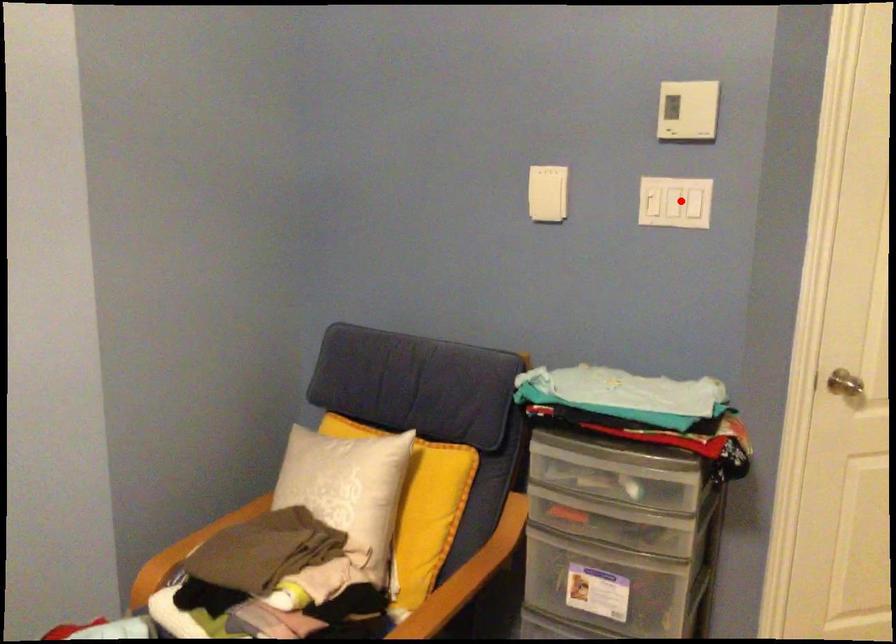
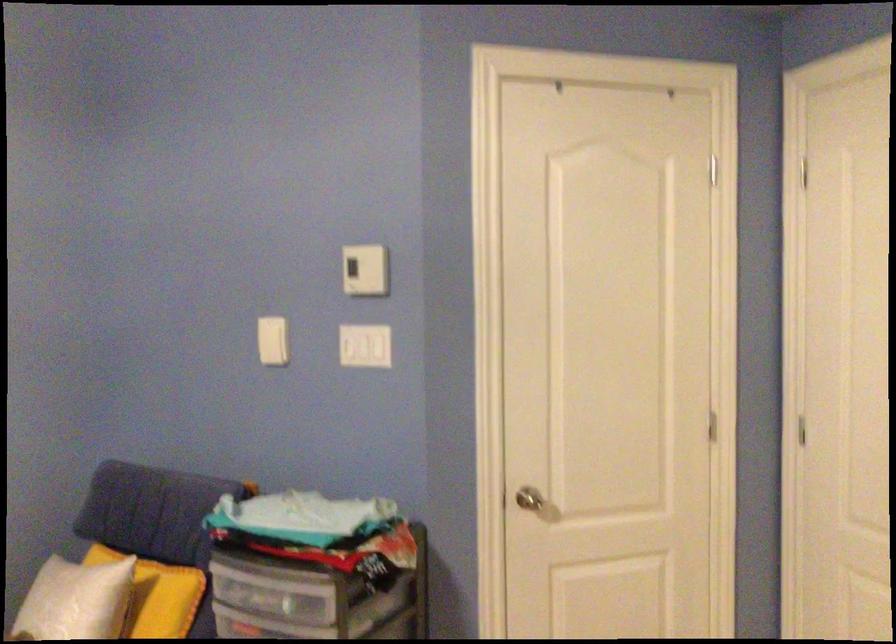
Question: I am providing you with two images of the same scene from different viewpoints. Image1 has a red point marked. In image2, the corresponding 3D location appears at what relative position? Reply with the corresponding letter.

Choices:
 (A) Closer
 (B) Farther

Answer: (B)